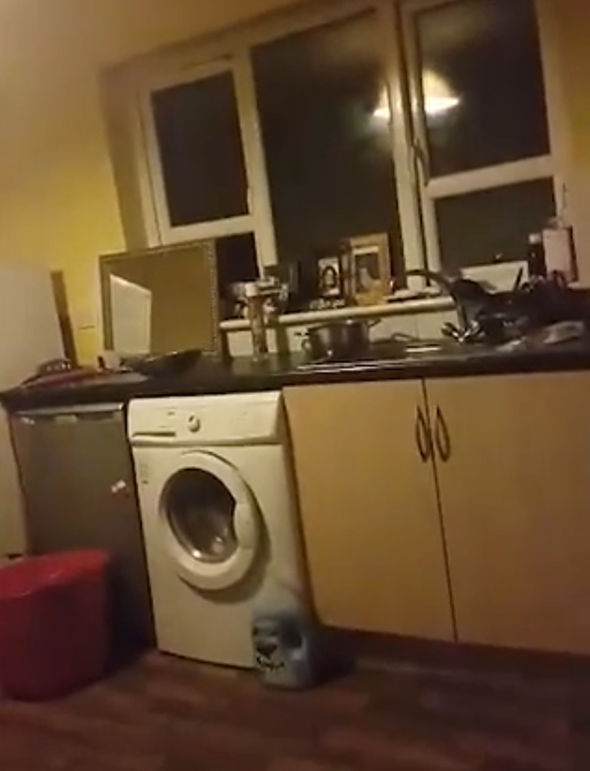
At what (x,y) coordinates should I click in order to perform the action: click on grey plastic container. Please return your answer as a coordinate pair (x, y). The image size is (590, 771). Looking at the image, I should click on (280, 671).